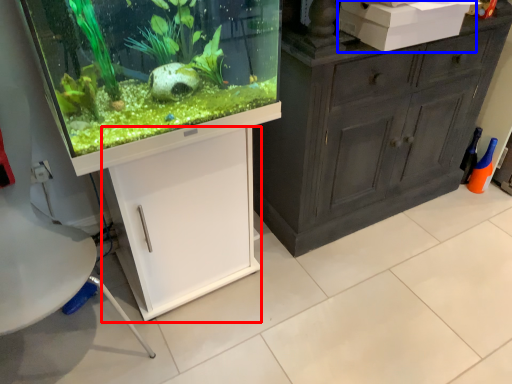
Question: Which of the following is the closest to the observer, cabinetry (highlighted by a red box) or box (highlighted by a blue box)?

Choices:
 (A) cabinetry
 (B) box

Answer: (A)